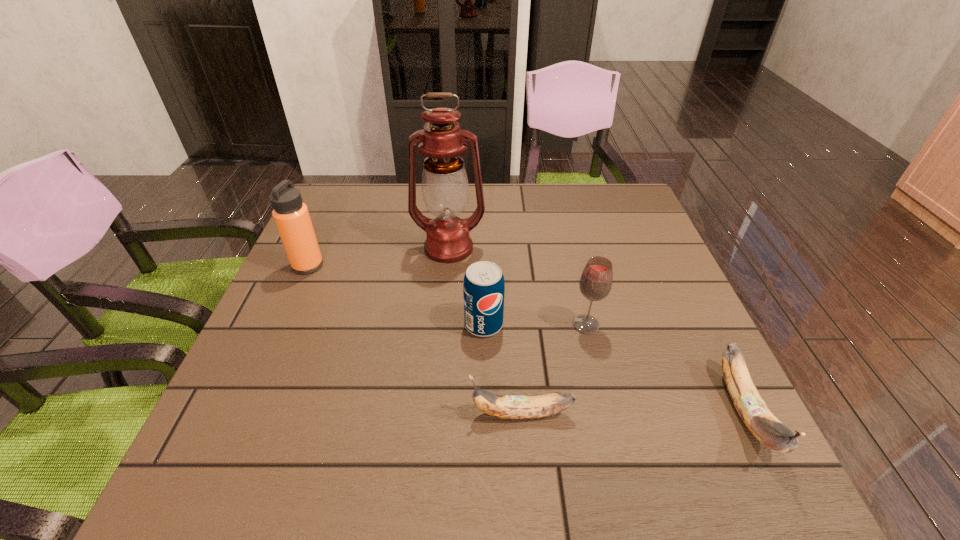
The image size is (960, 540). I want to click on vacant space located 0.180m on the peel of the shortest object, so click(371, 414).

Where is `blank space located on the peel of the shortest object`? blank space located on the peel of the shortest object is located at coordinates (267, 414).

You are a GUI agent. You are given a task and a screenshot of the screen. Output one action in this format:
    pyautogui.click(x=<x>, y=<y>)
    Task: Click on the vacant space located 0.160m on the front of the glass drink container
    The height and width of the screenshot is (540, 960).
    Given the screenshot: What is the action you would take?
    pyautogui.click(x=605, y=402)

Identify the location of free point located 0.060m on the left of the tallest object. The image size is (960, 540). (390, 248).

The height and width of the screenshot is (540, 960). I want to click on free spot located 0.320m on the right of the thermos bottle, so click(x=450, y=266).

This screenshot has height=540, width=960. I want to click on free location located 0.090m on the back of the pop, so click(x=483, y=284).

The width and height of the screenshot is (960, 540). Find the location of `object that is at the left edge`. object that is at the left edge is located at coordinates (x=291, y=216).

Locate an element on the screen. Image resolution: width=960 pixels, height=540 pixels. object at the right edge is located at coordinates (752, 409).

This screenshot has height=540, width=960. Find the location of `object located at the near right corner`. object located at the near right corner is located at coordinates (752, 409).

Where is `free spot at the far edge of the desktop`? This screenshot has height=540, width=960. free spot at the far edge of the desktop is located at coordinates (555, 225).